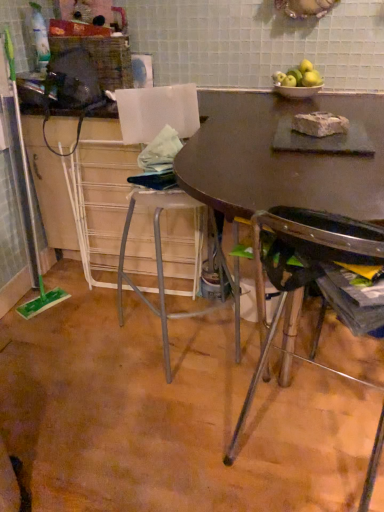
Identify the location of blank area to the left of metallic silver chair at lower right. (149, 453).